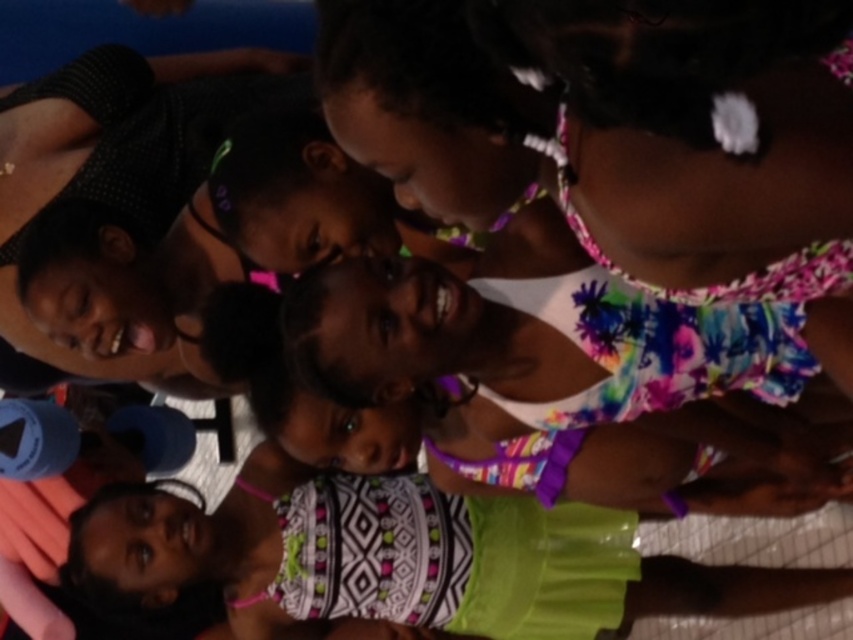
Question: Observing the image, what is the correct spatial positioning of matte black hair at upper left in reference to patterned fabric dress at lower left?

Choices:
 (A) right
 (B) left

Answer: (B)

Question: Can you confirm if matte black hair at upper left is positioned below patterned fabric dress at lower left?

Choices:
 (A) yes
 (B) no

Answer: (B)

Question: Which point is farther to the camera?

Choices:
 (A) patterned fabric dress at lower left
 (B) matte black hair at upper left

Answer: (A)

Question: Which object appears closest to the camera in this image?

Choices:
 (A) matte black hair at upper left
 (B) patterned fabric dress at lower left

Answer: (A)

Question: Among these points, which one is farthest from the camera?

Choices:
 (A) (88, 529)
 (B) (90, 189)

Answer: (A)

Question: Is matte black hair at upper left above patterned fabric dress at lower left?

Choices:
 (A) no
 (B) yes

Answer: (B)